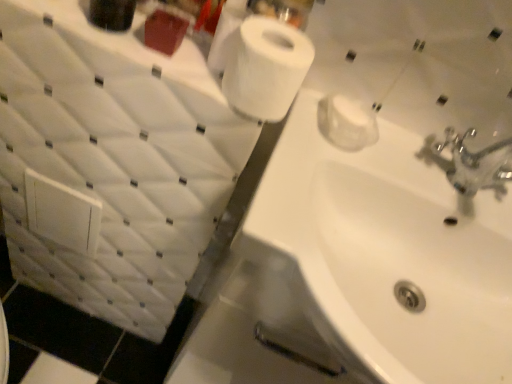
Question: Can you confirm if white matte toilet paper at upper center is smaller than white glossy sink at center?

Choices:
 (A) yes
 (B) no

Answer: (A)

Question: From the image's perspective, is white matte toilet paper at upper center above white glossy sink at center?

Choices:
 (A) no
 (B) yes

Answer: (B)

Question: Considering the relative positions of white matte toilet paper at upper center and white glossy sink at center in the image provided, is white matte toilet paper at upper center in front of white glossy sink at center?

Choices:
 (A) yes
 (B) no

Answer: (A)

Question: From a real-world perspective, is white matte toilet paper at upper center under white glossy sink at center?

Choices:
 (A) no
 (B) yes

Answer: (A)

Question: Can you confirm if white matte toilet paper at upper center is shorter than white glossy sink at center?

Choices:
 (A) no
 (B) yes

Answer: (B)

Question: From the image's perspective, is white matte toilet paper at upper center below white glossy sink at center?

Choices:
 (A) yes
 (B) no

Answer: (B)

Question: Considering the relative sizes of white glossy sink at center and white matte toilet paper at upper center in the image provided, is white glossy sink at center wider than white matte toilet paper at upper center?

Choices:
 (A) no
 (B) yes

Answer: (B)

Question: From the image's perspective, would you say white glossy sink at center is positioned over white matte toilet paper at upper center?

Choices:
 (A) yes
 (B) no

Answer: (B)

Question: From a real-world perspective, is white glossy sink at center over white matte toilet paper at upper center?

Choices:
 (A) yes
 (B) no

Answer: (B)

Question: Could white matte toilet paper at upper center be considered to be inside white glossy sink at center?

Choices:
 (A) no
 (B) yes

Answer: (A)

Question: Is white glossy sink at center aimed at white matte toilet paper at upper center?

Choices:
 (A) no
 (B) yes

Answer: (A)

Question: Is white glossy sink at center thinner than white matte toilet paper at upper center?

Choices:
 (A) yes
 (B) no

Answer: (B)

Question: From the image's perspective, is white matte toilet paper at upper center located above or below white glossy sink at center?

Choices:
 (A) below
 (B) above

Answer: (B)